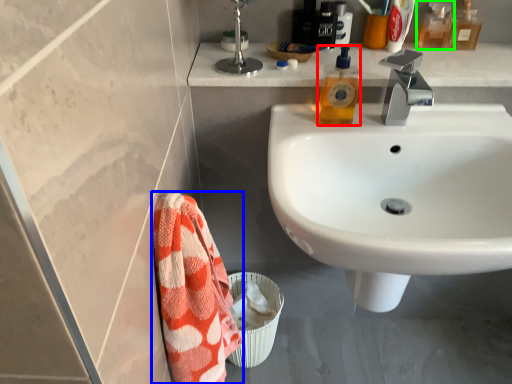
Question: Considering the real-world distances, which object is farthest from toiletry (highlighted by a red box)? beach towel (highlighted by a blue box) or mouthwash (highlighted by a green box)?

Choices:
 (A) beach towel
 (B) mouthwash

Answer: (A)